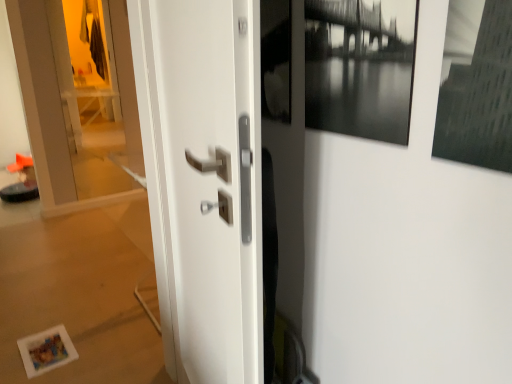
Question: Can you confirm if black matte picture frame at upper right is wider than transparent glass door at left?

Choices:
 (A) no
 (B) yes

Answer: (B)

Question: Is black matte picture frame at upper right bigger than transparent glass door at left?

Choices:
 (A) no
 (B) yes

Answer: (A)

Question: Is black matte picture frame at upper right taller than transparent glass door at left?

Choices:
 (A) no
 (B) yes

Answer: (A)

Question: Would you say transparent glass door at left is part of black matte picture frame at upper right's contents?

Choices:
 (A) no
 (B) yes

Answer: (A)

Question: Are black matte picture frame at upper right and transparent glass door at left located far from each other?

Choices:
 (A) yes
 (B) no

Answer: (A)

Question: Is black matte picture frame at upper right next to transparent glass door at left and touching it?

Choices:
 (A) yes
 (B) no

Answer: (B)

Question: Can you confirm if transparent glass door at left is bigger than white glossy door handle at center?

Choices:
 (A) yes
 (B) no

Answer: (B)

Question: Considering the relative sizes of transparent glass door at left and white glossy door handle at center in the image provided, is transparent glass door at left smaller than white glossy door handle at center?

Choices:
 (A) yes
 (B) no

Answer: (A)

Question: Can we say transparent glass door at left lies outside white glossy door handle at center?

Choices:
 (A) yes
 (B) no

Answer: (A)

Question: Is white glossy door handle at center at the back of transparent glass door at left?

Choices:
 (A) no
 (B) yes

Answer: (A)

Question: From a real-world perspective, is transparent glass door at left physically above white glossy door handle at center?

Choices:
 (A) yes
 (B) no

Answer: (A)

Question: Considering the relative positions of transparent glass door at left and white glossy door handle at center in the image provided, is transparent glass door at left to the left of white glossy door handle at center from the viewer's perspective?

Choices:
 (A) no
 (B) yes

Answer: (B)

Question: Are white glossy door handle at center and transparent glass door at left making contact?

Choices:
 (A) no
 (B) yes

Answer: (A)